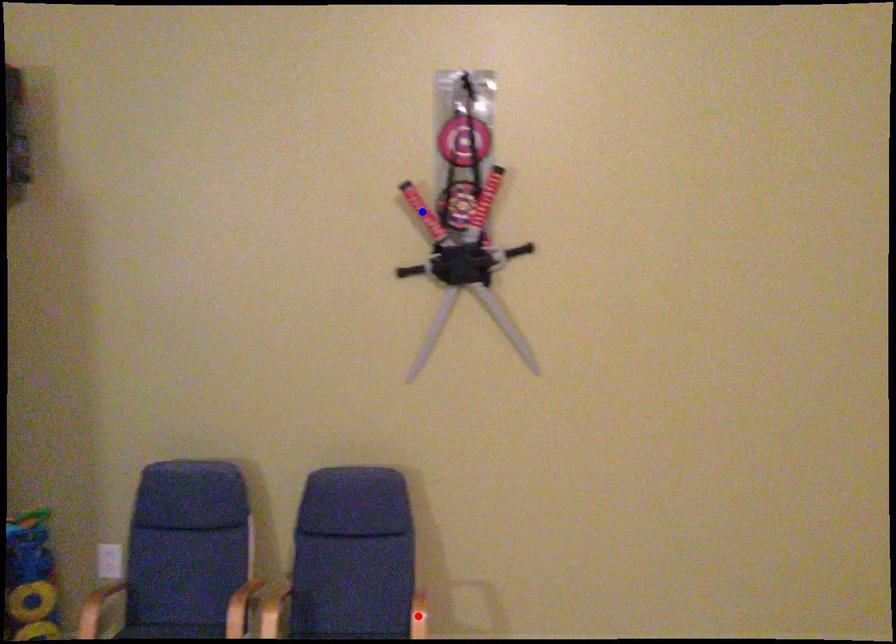
Question: Two points are marked on the image. Which point is closer to the camera?

Choices:
 (A) Blue point is closer.
 (B) Red point is closer.

Answer: (B)